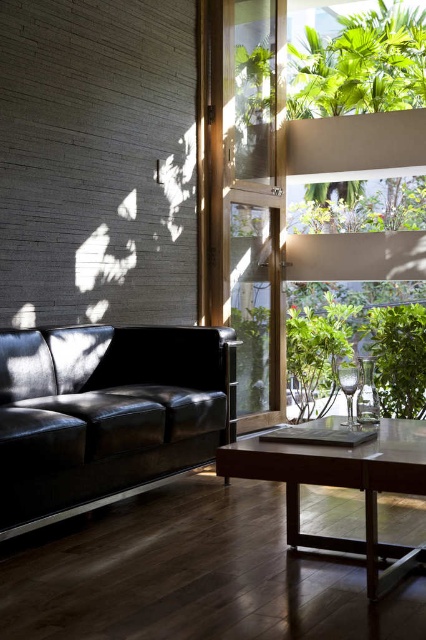
Question: Does matte black leather couch at left have a larger size compared to green leafy plant at center?

Choices:
 (A) no
 (B) yes

Answer: (A)

Question: Estimate the real-world distances between objects in this image. Which object is closer to the green leafy plant at center?

Choices:
 (A) glossy wood table at center
 (B) matte black leather couch at left
 (C) transparent glass door at upper center
 (D) green leafy plant at right

Answer: (A)

Question: Does glossy wood table at center appear over green leafy plant at right?

Choices:
 (A) no
 (B) yes

Answer: (B)

Question: Which point is farther from the camera taking this photo?

Choices:
 (A) (301, 148)
 (B) (131, 358)
 (C) (256, 464)
 (D) (391, 404)

Answer: (D)

Question: Does glossy wood table at center appear under green leafy plant at center?

Choices:
 (A) yes
 (B) no

Answer: (A)

Question: Which point appears closest to the camera in this image?

Choices:
 (A) (221, 401)
 (B) (423, 410)
 (C) (399, 477)
 (D) (294, 396)

Answer: (C)